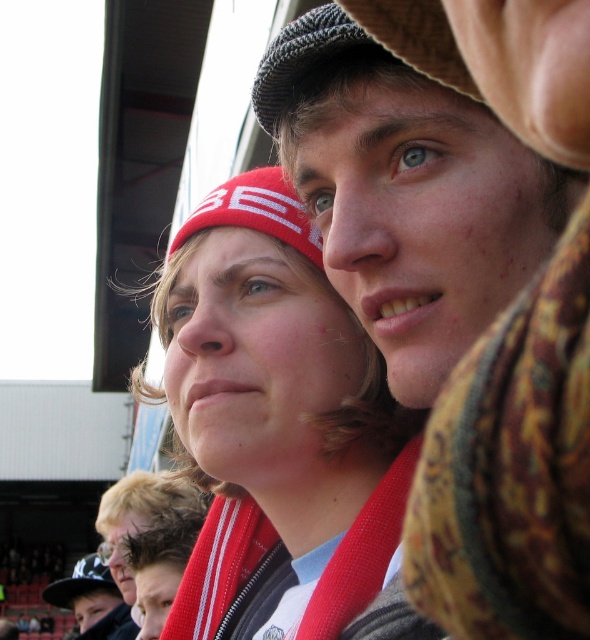
Question: Can you confirm if floral scarf at center is positioned above knitted gray cap at upper center?

Choices:
 (A) yes
 (B) no

Answer: (B)

Question: Based on their relative distances, which object is farther from the floral scarf at center?

Choices:
 (A) black fabric baseball cap at lower left
 (B) knitted gray cap at upper center

Answer: (A)

Question: Does knitted gray cap at upper center come behind black fabric baseball cap at lower left?

Choices:
 (A) yes
 (B) no

Answer: (B)

Question: Is knitted gray cap at upper center to the right of black fabric baseball cap at lower left from the viewer's perspective?

Choices:
 (A) no
 (B) yes

Answer: (B)

Question: Estimate the real-world distances between objects in this image. Which object is farther from the black fabric baseball cap at lower left?

Choices:
 (A) floral scarf at center
 (B) red fabric scarf at center

Answer: (A)

Question: Considering the real-world distances, which object is farthest from the knitted gray cap at upper center?

Choices:
 (A) floral scarf at center
 (B) black fabric baseball cap at lower left
 (C) red fabric scarf at center

Answer: (B)